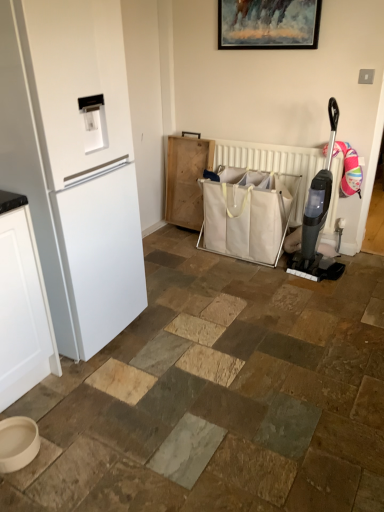
Question: In terms of width, does black plastic vacuum cleaner at right look wider or thinner when compared to wooden picture frame at upper center?

Choices:
 (A) wide
 (B) thin

Answer: (A)

Question: Is black plastic vacuum cleaner at right inside the boundaries of wooden picture frame at upper center, or outside?

Choices:
 (A) inside
 (B) outside

Answer: (B)

Question: Which is farther from the black plastic vacuum cleaner at right?

Choices:
 (A) white canvas shopping bag at center
 (B) wooden picture frame at upper center
 (C) white fabric bag at center
 (D) white matte refrigerator at left

Answer: (D)

Question: Which is nearer to the black plastic vacuum cleaner at right?

Choices:
 (A) wooden picture frame at upper center
 (B) white canvas shopping bag at center
 (C) white fabric bag at center
 (D) white matte refrigerator at left

Answer: (C)